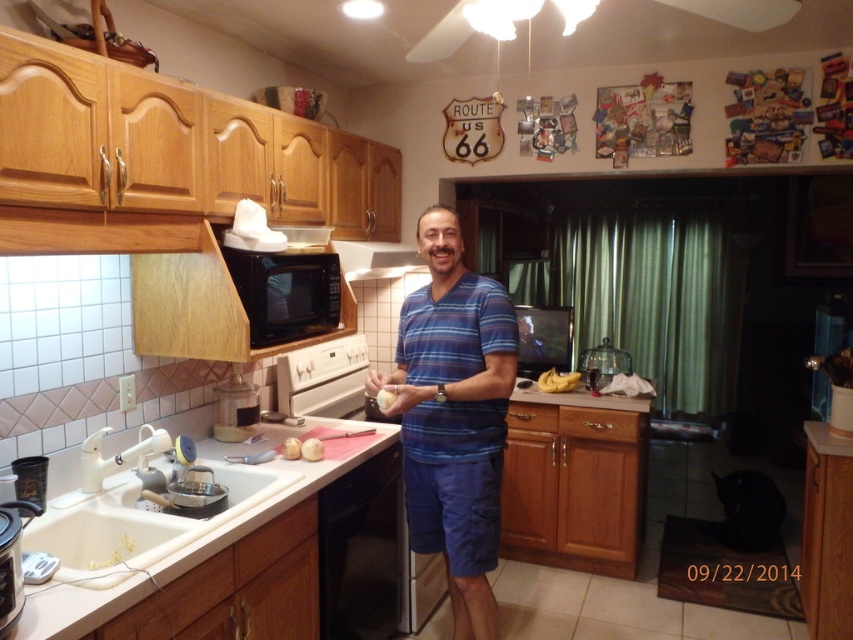
You are a chef preparing a recipe that requires blending ingredients. You have a transparent glass blender at right and a white matte onion at center. Where should you place the onion to start the process?

The white matte onion at center should be placed into the transparent glass blender at right to start the process.

In the kitchen scene, there is a transparent glass blender at right and a white matte onion at center. Which object is positioned to the left of the other?

The white matte onion at center is to the left of the transparent glass blender at right.

From the picture: You are trying to decide whether to place the white matte onion at center into the transparent glass blender at right. Based on their sizes, will the onion fit inside the blender?

The transparent glass blender at right is much taller than the white matte onion at center, so the onion should fit inside the blender.